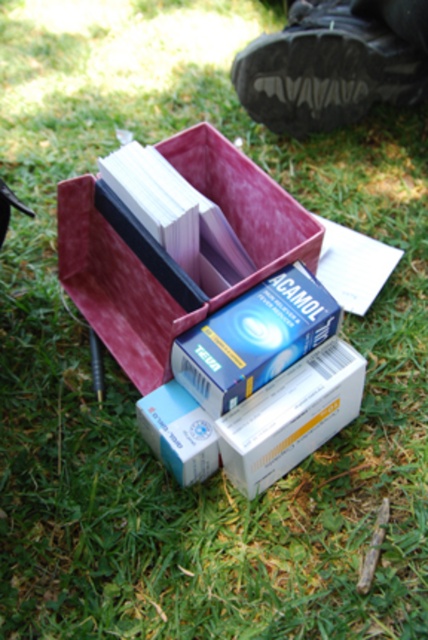
You are organizing items on a table and need to place the white cardboard box at center and the matte purple book at center. According to the scene, where should you position them relative to each other?

The white cardboard box at center should be placed below the matte purple book at center as per the scene description.

You are a delivery person who just arrived at a location and need to place a new package on the grassy area. The package must be placed exactly at the coordinates given for the white cardboard box at center. What are the coordinates where you should place the new package?

The coordinates for the white cardboard box at center are at point (291, 417), so you should place the new package at those coordinates.